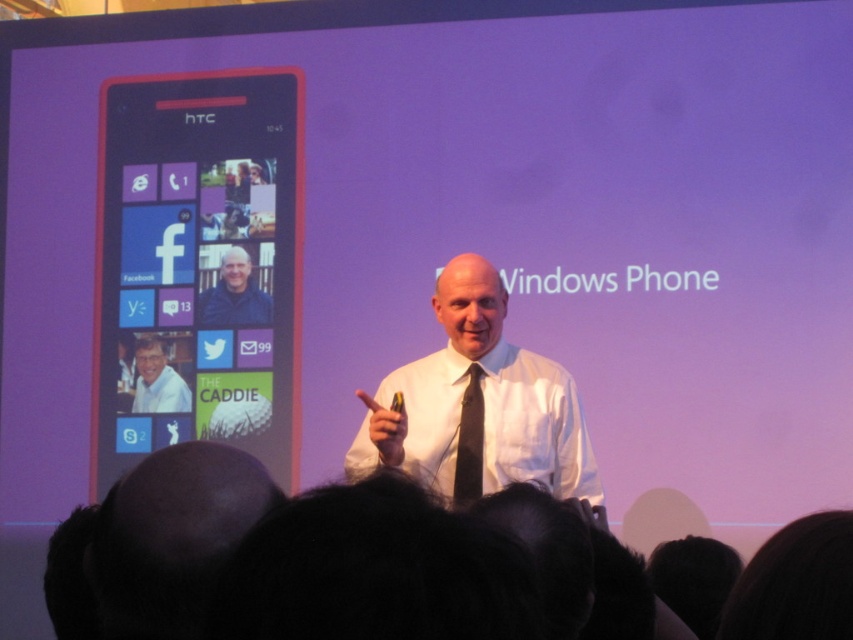
Looking at this image, is pink glossy phone at left in front of matte white shirt at center?

Yes, pink glossy phone at left is in front of matte white shirt at center.

Is pink glossy phone at left bigger than matte white shirt at center?

Yes, pink glossy phone at left is bigger than matte white shirt at center.

You are a GUI agent. You are given a task and a screenshot of the screen. Output one action in this format:
    pyautogui.click(x=<x>, y=<y>)
    Task: Click on the pink glossy phone at left
    The width and height of the screenshot is (853, 640).
    Given the screenshot: What is the action you would take?
    pyautogui.click(x=200, y=266)

Does white shirt at center have a greater height compared to matte black shirt at center?

Correct, white shirt at center is much taller as matte black shirt at center.

Is point (416, 429) positioned after point (229, 282)?

No, (416, 429) is in front of (229, 282).

Where is `white shirt at center`? white shirt at center is located at coordinates (479, 404).

Find the location of a particular element. The image size is (853, 640). pink glossy phone at left is located at coordinates (200, 266).

Who is more distant from viewer, (151, 412) or (479, 394)?

Positioned behind is point (151, 412).

Identify the location of pink glossy phone at left. The image size is (853, 640). (200, 266).